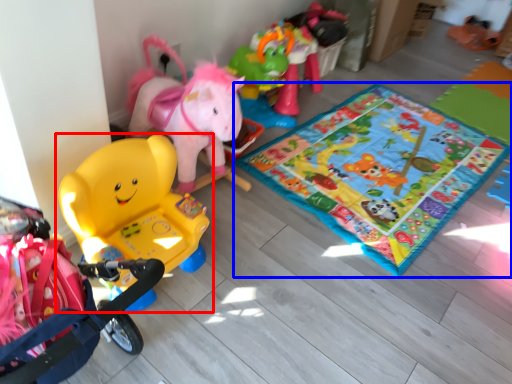
Question: Which point is closer to the camera, toy (highlighted by a red box) or yoga mat (highlighted by a blue box)?

Choices:
 (A) toy
 (B) yoga mat

Answer: (A)